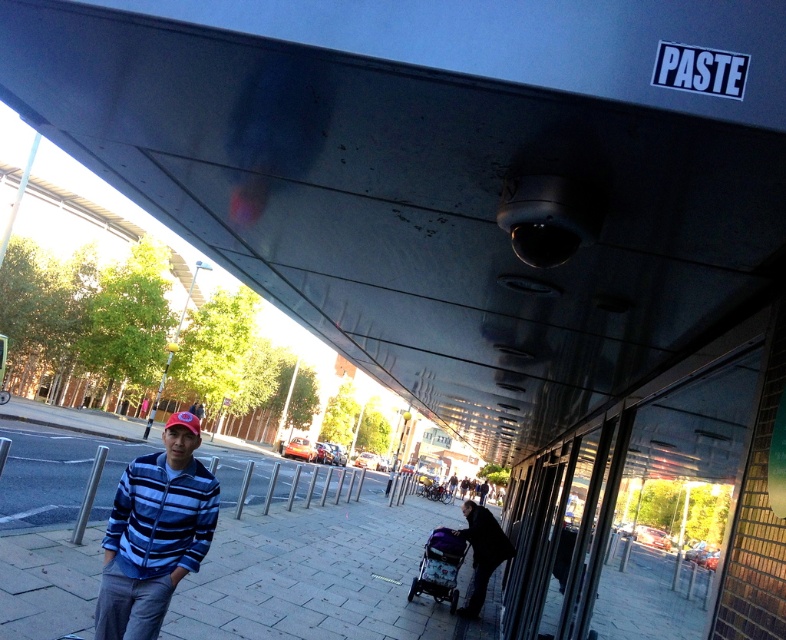
Question: Which of these objects is positioned closest to the blue striped jacket at center?

Choices:
 (A) gray concrete pavement at lower left
 (B) dark gray fabric stroller at lower center
 (C) purple fabric stroller at center

Answer: (C)

Question: Which is nearer to the blue striped jacket at center?

Choices:
 (A) purple fabric stroller at center
 (B) gray concrete pavement at lower left

Answer: (A)

Question: Does gray concrete pavement at lower left have a smaller size compared to purple fabric stroller at center?

Choices:
 (A) no
 (B) yes

Answer: (A)

Question: Does dark gray fabric stroller at lower center appear on the left side of purple fabric stroller at center?

Choices:
 (A) no
 (B) yes

Answer: (A)

Question: Which object is farther from the camera taking this photo?

Choices:
 (A) blue striped jacket at center
 (B) dark gray fabric stroller at lower center
 (C) purple fabric stroller at center
 (D) gray concrete pavement at lower left

Answer: (B)

Question: Is the position of dark gray fabric stroller at lower center more distant than that of purple fabric stroller at center?

Choices:
 (A) yes
 (B) no

Answer: (A)